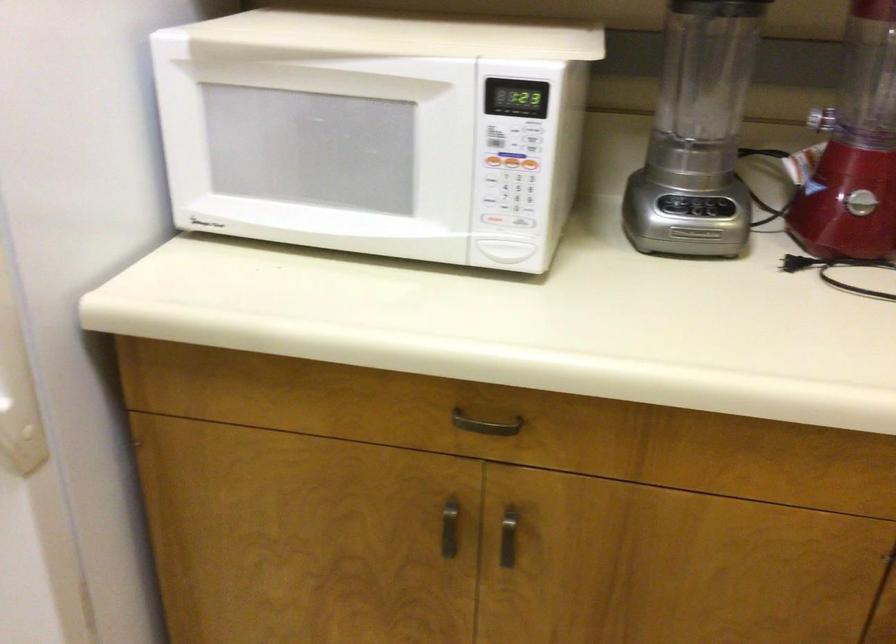
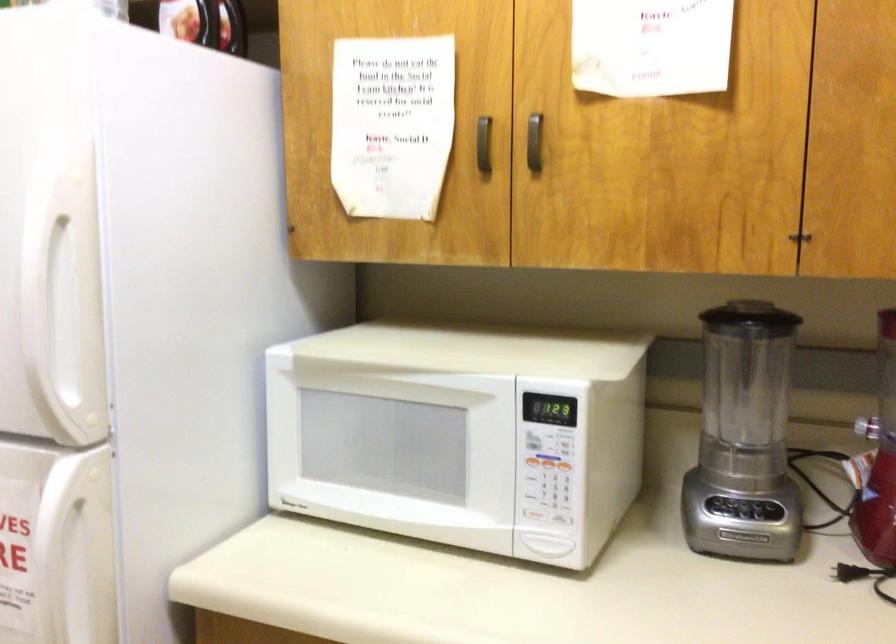
Find the pixel in the second image that matches [529,162] in the first image.

(565, 467)